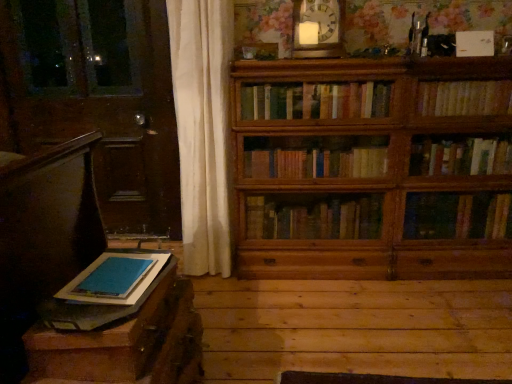
Question: Is wooden clock at upper center located within wooden table at lower left?

Choices:
 (A) yes
 (B) no

Answer: (B)

Question: Does wooden table at lower left have a lesser height compared to wooden clock at upper center?

Choices:
 (A) yes
 (B) no

Answer: (A)

Question: Does wooden table at lower left touch wooden clock at upper center?

Choices:
 (A) no
 (B) yes

Answer: (A)

Question: Is wooden table at lower left at the left side of wooden clock at upper center?

Choices:
 (A) no
 (B) yes

Answer: (B)

Question: Considering the relative sizes of wooden table at lower left and wooden clock at upper center in the image provided, is wooden table at lower left smaller than wooden clock at upper center?

Choices:
 (A) no
 (B) yes

Answer: (A)

Question: Does wooden table at lower left have a greater height compared to wooden clock at upper center?

Choices:
 (A) no
 (B) yes

Answer: (A)

Question: Can you confirm if dark brown leather armchair at left is shorter than blue felt book at lower left, acting as the 1th book starting from the front?

Choices:
 (A) yes
 (B) no

Answer: (B)

Question: Does dark brown leather armchair at left have a larger size compared to blue felt book at lower left, marked as the 1th book in a left-to-right arrangement?

Choices:
 (A) yes
 (B) no

Answer: (A)

Question: Does dark brown leather armchair at left have a lesser width compared to blue felt book at lower left, which is the second book in right-to-left order?

Choices:
 (A) no
 (B) yes

Answer: (A)

Question: From a real-world perspective, does dark brown leather armchair at left sit lower than blue felt book at lower left, arranged as the second book when viewed from the back?

Choices:
 (A) no
 (B) yes

Answer: (B)

Question: Is dark brown leather armchair at left oriented away from blue felt book at lower left, the 2th book from the top?

Choices:
 (A) yes
 (B) no

Answer: (B)

Question: Considering the relative sizes of dark brown leather armchair at left and blue felt book at lower left, acting as the 1th book starting from the front, in the image provided, is dark brown leather armchair at left wider than blue felt book at lower left, acting as the 1th book starting from the front,?

Choices:
 (A) no
 (B) yes

Answer: (B)

Question: From a real-world perspective, is wooden bookshelf at right, arranged as the 2th book when viewed from the front, positioned over wooden table at lower left based on gravity?

Choices:
 (A) no
 (B) yes

Answer: (B)